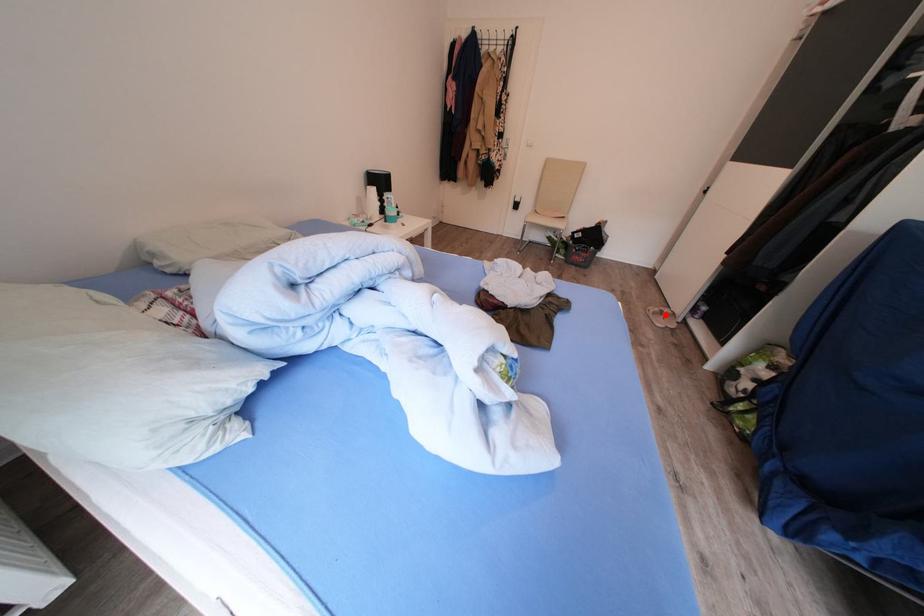
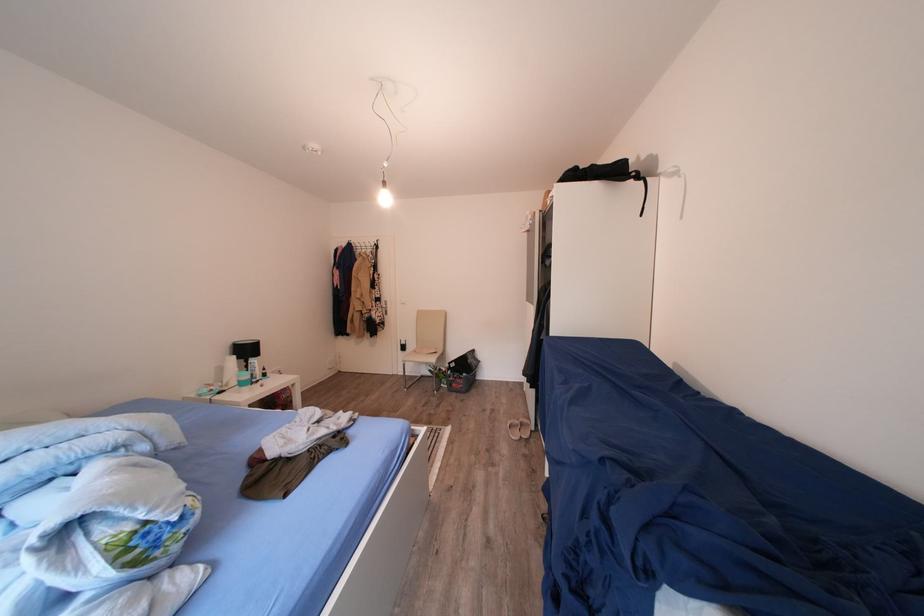
In the second image, find the point that corresponds to the highlighted location in the first image.

(526, 427)